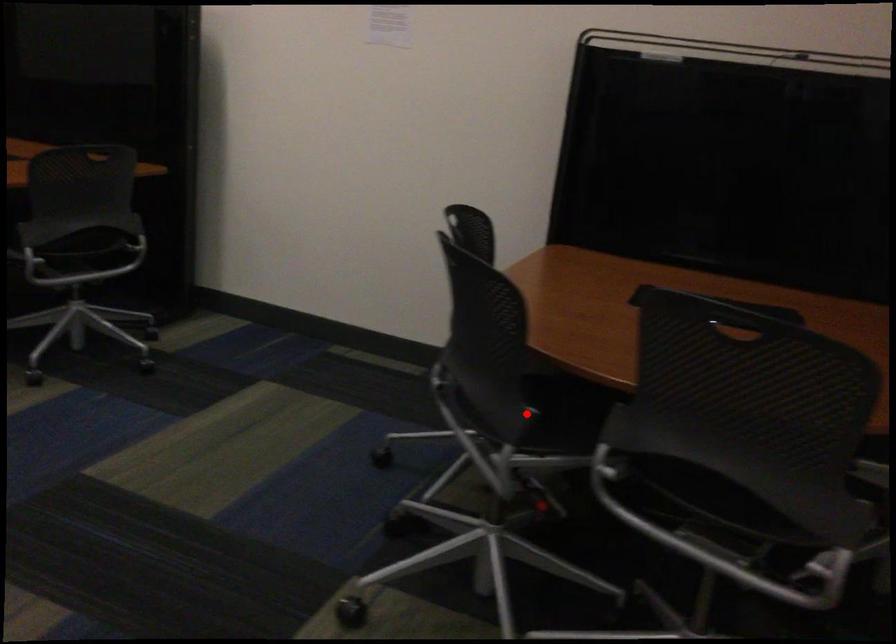
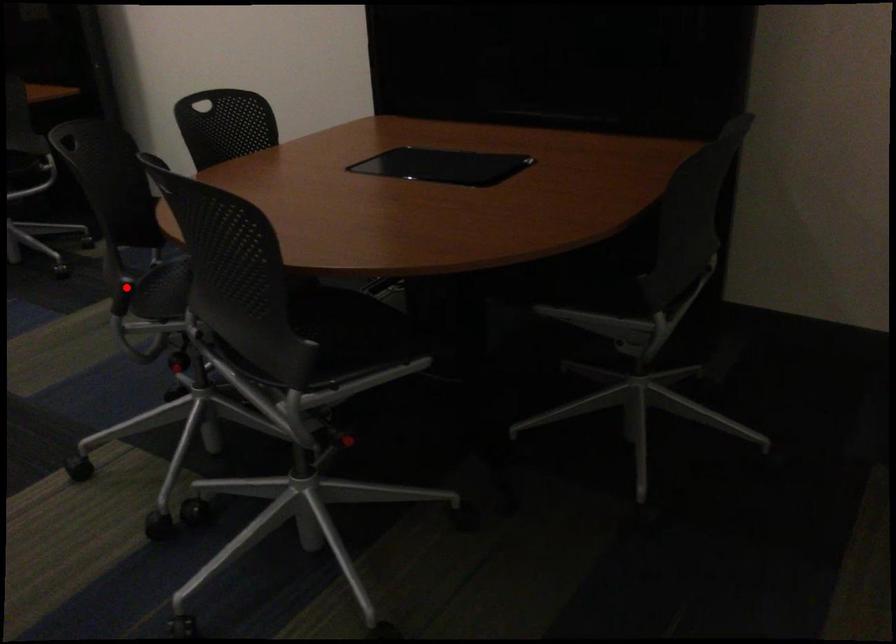
I am providing you with two images of the same scene from different viewpoints. A red point is marked on the first image and another point is marked on the second image. Are the points marked in image1 and image2 representing the same 3D position?

Yes